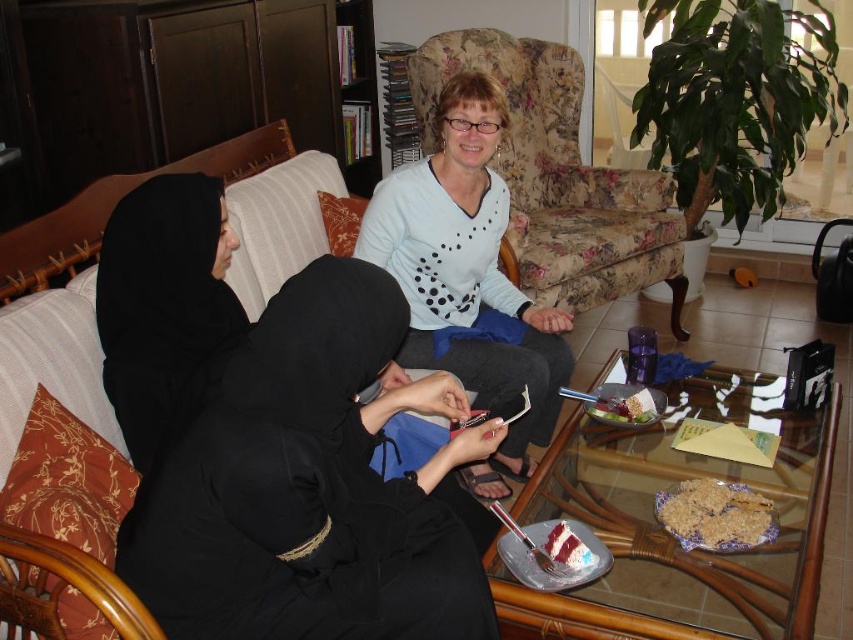
Does transparent glass table at center have a greater height compared to floral fabric armchair at center?

Incorrect, transparent glass table at center's height is not larger of floral fabric armchair at center's.

Between point (604, 524) and point (451, 61), which one is positioned in front?

Point (604, 524)

Between point (637, 595) and point (421, 92), which one is positioned in front?

Point (637, 595) is in front.

This screenshot has width=853, height=640. What are the coordinates of `transparent glass table at center` in the screenshot? It's located at (671, 536).

Is transparent glass table at center bigger than white ceramic plate at lower center?

Yes.

Does point (614, 486) come farther from viewer compared to point (524, 570)?

Yes.

Find the location of a particular element. The height and width of the screenshot is (640, 853). transparent glass table at center is located at coordinates (671, 536).

Describe the element at coordinates (671, 536) in the screenshot. I see `transparent glass table at center` at that location.

Does transparent glass table at center have a greater height compared to crumbly brown cake at lower center?

Yes.

Which is in front, point (746, 611) or point (717, 515)?

Point (746, 611) is in front.

Find the location of a particular element. Image resolution: width=853 pixels, height=640 pixels. transparent glass table at center is located at coordinates 671,536.